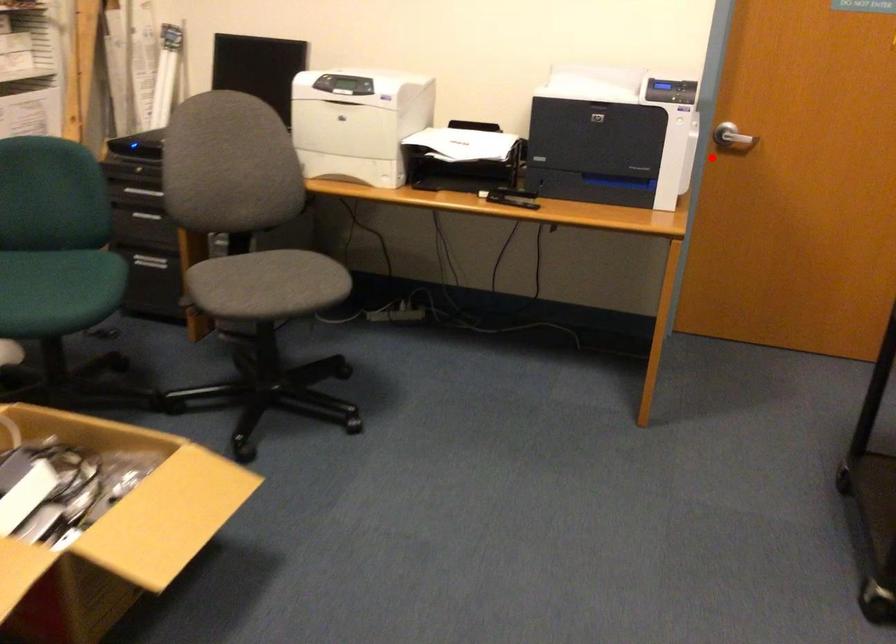
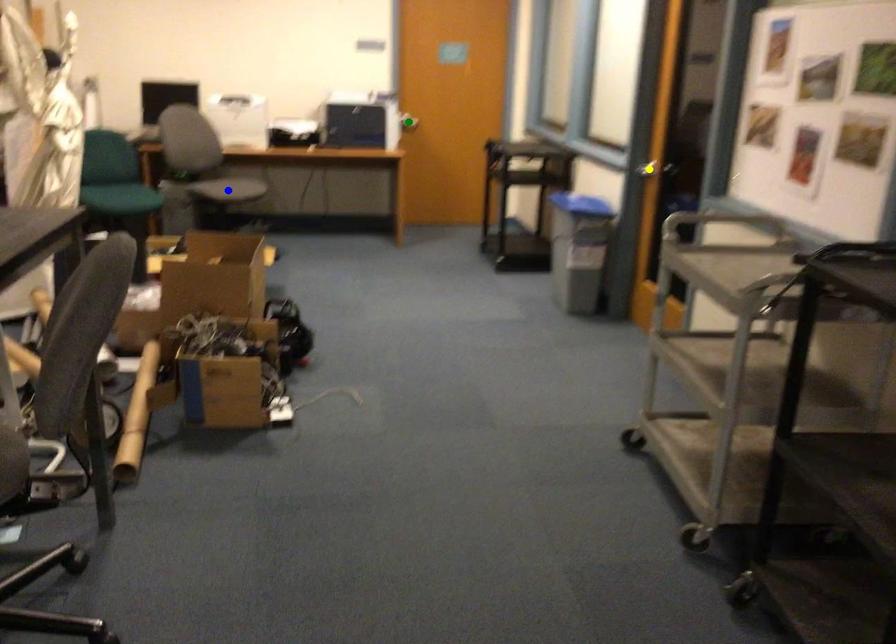
Question: I am providing you with two images of the same scene from different viewpoints. A red point is marked on the first image. You are given multiple points on the second image. Which point in image 2 is actually the same real-world point as the red point in image 1?

Choices:
 (A) yellow point
 (B) green point
 (C) blue point

Answer: (B)